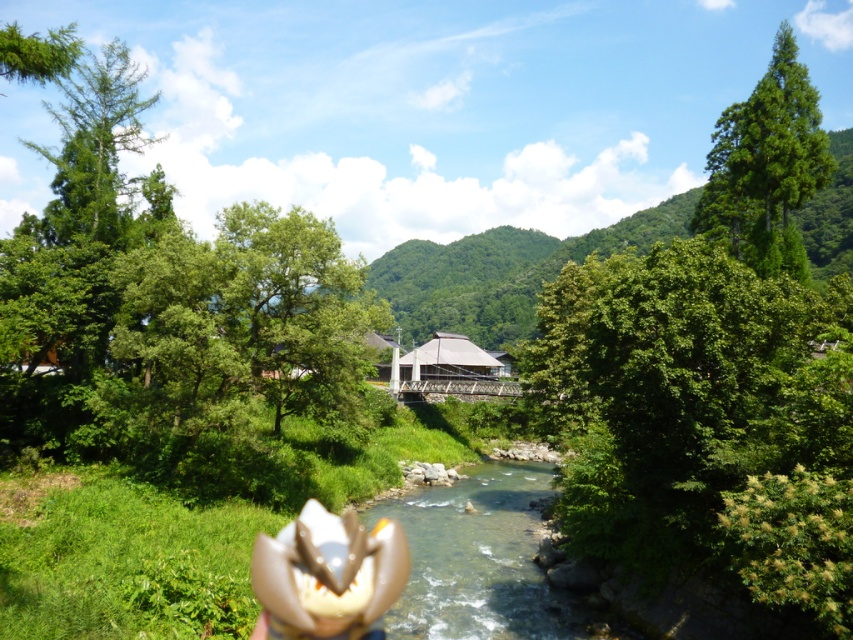
Does green glossy tree at upper right appear over white matte flower at center?

Indeed, green glossy tree at upper right is positioned over white matte flower at center.

Does green glossy tree at upper right appear on the left side of white matte flower at center?

In fact, green glossy tree at upper right is to the right of white matte flower at center.

Who is more distant from viewer, (722, 218) or (325, 513)?

Point (722, 218)

Image resolution: width=853 pixels, height=640 pixels. Find the location of `green glossy tree at upper right`. green glossy tree at upper right is located at coordinates (766, 166).

Between green leafy tree at left and green leafy tree at center, which one is positioned lower?

green leafy tree at center is below.

Who is positioned more to the left, green leafy tree at left or green leafy tree at center?

Positioned to the left is green leafy tree at left.

Where is `green leafy tree at left`? green leafy tree at left is located at coordinates (170, 316).

Does green leafy tree at left come behind clear water at center?

Yes, green leafy tree at left is behind clear water at center.

Is point (177, 376) positioned before point (527, 492)?

Yes, point (177, 376) is in front of point (527, 492).

At what (x,y) coordinates should I click in order to perform the action: click on green leafy tree at left. Please return your answer as a coordinate pair (x, y). The width and height of the screenshot is (853, 640). Looking at the image, I should click on tap(170, 316).